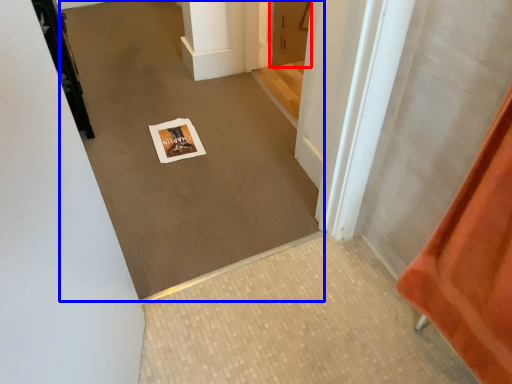
Question: Which point is closer to the camera, door (highlighted by a red box) or plain (highlighted by a blue box)?

Choices:
 (A) door
 (B) plain

Answer: (B)